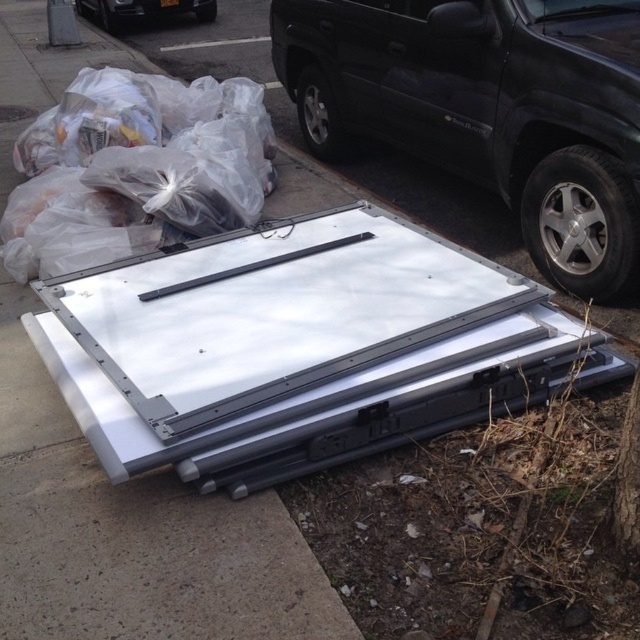
Question: Which point appears closest to the camera in this image?

Choices:
 (A) (582, 161)
 (B) (637, 500)
 (C) (72, 256)

Answer: (B)

Question: Is white plastic container at lower center smaller than clear plastic bags at upper left?

Choices:
 (A) yes
 (B) no

Answer: (B)

Question: Is black plastic suv at upper right bigger than white plastic container at lower center?

Choices:
 (A) yes
 (B) no

Answer: (B)

Question: Among these points, which one is farthest from the camera?

Choices:
 (A) (625, 426)
 (B) (483, 19)

Answer: (B)

Question: Which object is the farthest from the black plastic car at upper center?

Choices:
 (A) black plastic suv at upper right
 (B) white plastic container at lower center

Answer: (A)

Question: Considering the relative positions of brown rough bark at lower right and black plastic car at upper center in the image provided, where is brown rough bark at lower right located with respect to black plastic car at upper center?

Choices:
 (A) right
 (B) left

Answer: (A)